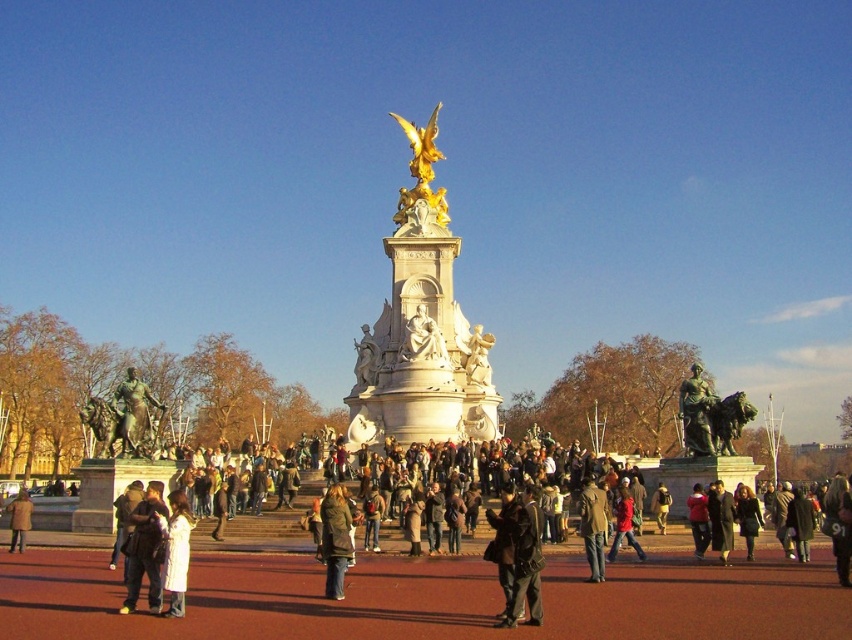
You are a tourist standing in the public square and want to take a photo of the bronze statue at left without the white fabric coat at lower left appearing in the frame. Is this possible given their positions?

The bronze statue at left is located above the white fabric coat at lower left, so you can angle your camera upwards to capture the bronze statue at left without including the white fabric coat at lower left in the shot.

You are a tourist visiting the square and want to take a photo of the bronze statue at left and the green textured coat at center. Which object should you position to your right side to include both in the frame?

To include both the bronze statue at left and the green textured coat at center in your photo, position the green textured coat at center to your right side since the bronze statue at left is located to the left of it.